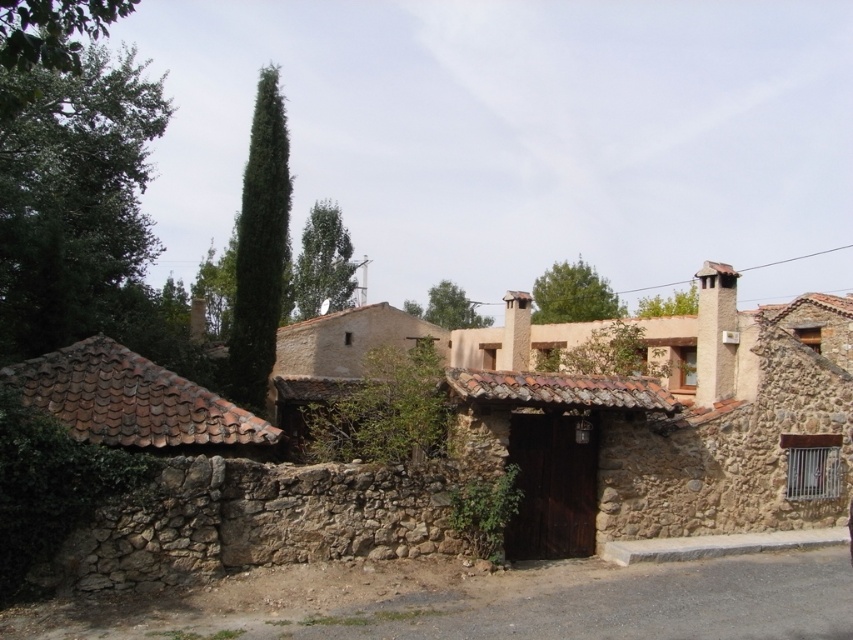
You are a painter planning to sketch this scene. You want to ensure the brown stone wall at center and the green leafy cypress at upper center are proportionally accurate. Which object should you draw wider in your sketch?

The brown stone wall at center should be drawn wider than the green leafy cypress at upper center in your sketch because the brown stone wall at center has a greater width compared to the green leafy cypress at upper center according to the description.

You are standing in front of the brown stone wall at center. If you walk straight ahead, will you exit the property through the dark wooden gate?

The brown stone wall at center is located at point [668,435], which suggests it is positioned towards the lower right of the image. Since the dark wooden gate is in the foreground and partially open, walking straight ahead from the wall might not lead directly to the gate. You may need to adjust your direction to reach the gate.